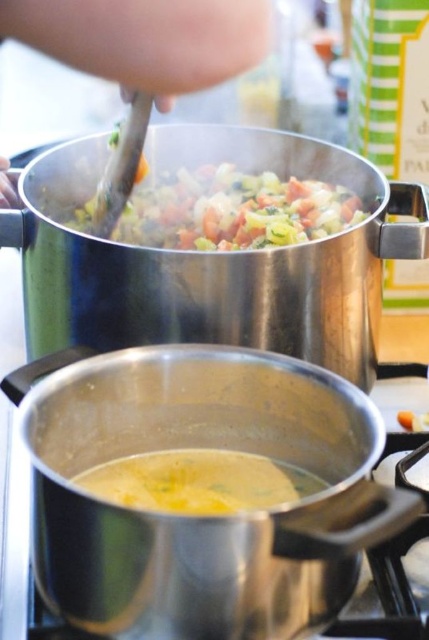
Can you confirm if skinny silver spoon at upper center is positioned to the right of vibrant mixed vegetables at upper center?

Incorrect, skinny silver spoon at upper center is not on the right side of vibrant mixed vegetables at upper center.

Find the location of a particular element. skinny silver spoon at upper center is located at coordinates point(145,38).